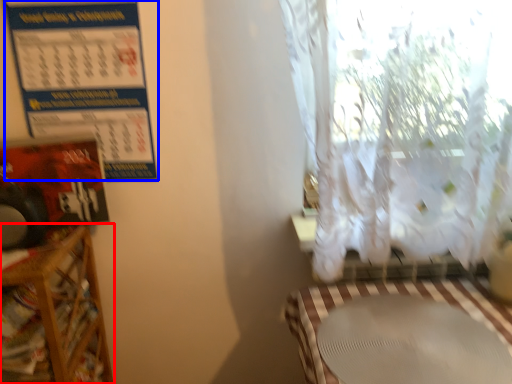
Question: Which object is further to the camera taking this photo, furniture (highlighted by a red box) or calendar (highlighted by a blue box)?

Choices:
 (A) furniture
 (B) calendar

Answer: (B)